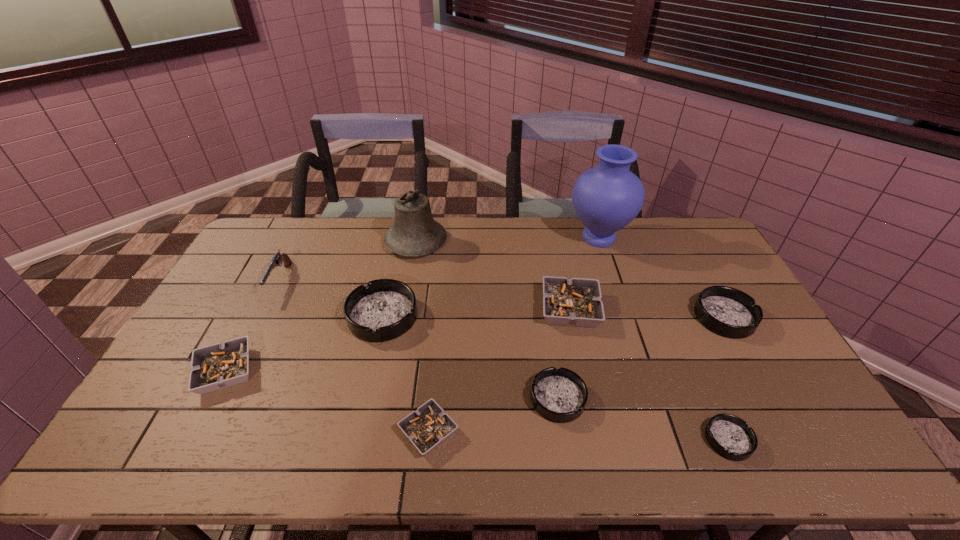
Where is `free space at the far edge of the desktop`? The image size is (960, 540). free space at the far edge of the desktop is located at coordinates (367, 227).

In the image, there is a desktop. What are the coordinates of `vacant area at the left edge` in the screenshot? It's located at [x=164, y=422].

At what (x,y) coordinates should I click in order to perform the action: click on free region at the right edge of the desktop. Please return your answer as a coordinate pair (x, y). This screenshot has height=540, width=960. Looking at the image, I should click on (703, 284).

Locate an element on the screen. Image resolution: width=960 pixels, height=540 pixels. free space at the far left corner of the desktop is located at coordinates (269, 228).

Where is `unoccupied area between the second smallest dark ashtray and the gun`? The width and height of the screenshot is (960, 540). unoccupied area between the second smallest dark ashtray and the gun is located at coordinates (419, 340).

This screenshot has width=960, height=540. In order to click on free space between the biggest dark ashtray and the rightmost gray ashtray in this screenshot , I will do `click(476, 313)`.

Find the location of a particular element. unoccupied area between the tallest object and the second biggest dark ashtray is located at coordinates (661, 278).

What are the coordinates of `free area in between the gun and the third biggest dark ashtray` in the screenshot? It's located at (419, 340).

The height and width of the screenshot is (540, 960). I want to click on free spot between the second smallest gray ashtray and the sixth ashtray from left to right, so click(477, 406).

The width and height of the screenshot is (960, 540). What are the coordinates of `free area in between the second biggest gray ashtray and the biggest dark ashtray` in the screenshot? It's located at (304, 344).